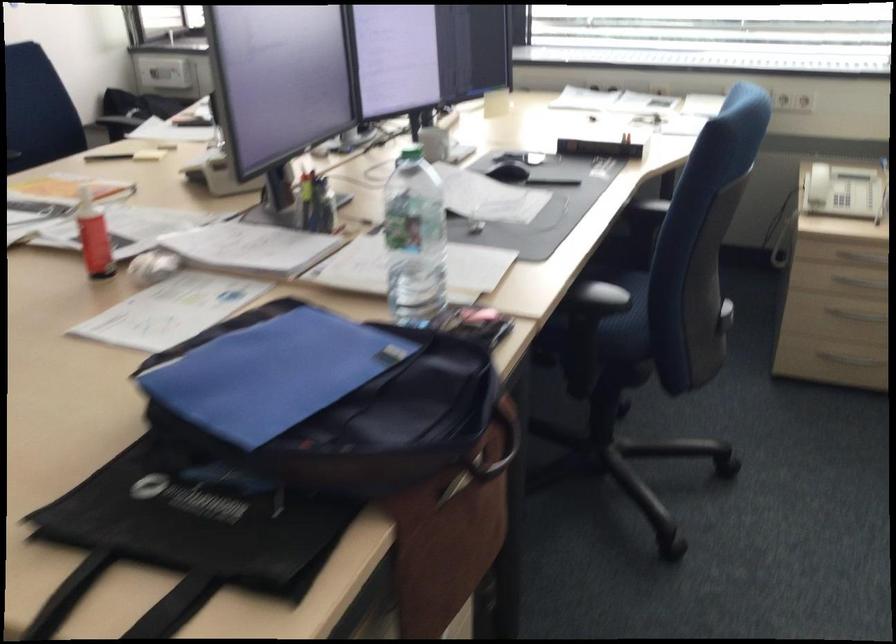
The image size is (896, 644). I want to click on laptop bag handle, so click(x=497, y=448).